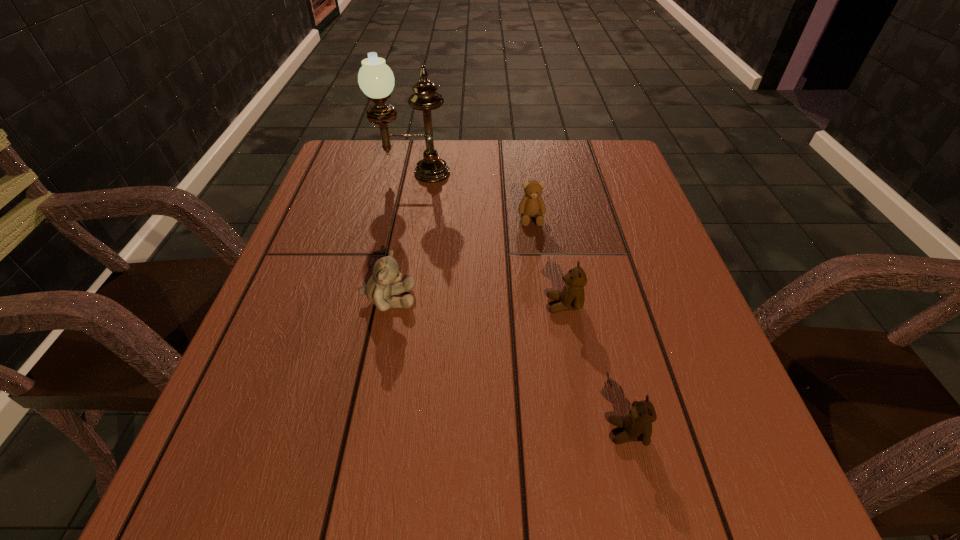
Image resolution: width=960 pixels, height=540 pixels. In the image, there is a desktop. In order to click on vacant space at the far left corner in this screenshot , I will do `click(355, 150)`.

Locate an element on the screen. The width and height of the screenshot is (960, 540). free space at the near left corner is located at coordinates (247, 489).

This screenshot has width=960, height=540. I want to click on blank space at the far right corner of the desktop, so click(592, 158).

This screenshot has height=540, width=960. In order to click on vacant area between the fourth nearest object and the rightmost teddy bear in this screenshot , I will do `click(580, 325)`.

At what (x,y) coordinates should I click in order to perform the action: click on free space between the rightmost object and the farthest teddy bear. Please return your answer as a coordinate pair (x, y). Looking at the image, I should click on (580, 325).

Where is `unoccupied area between the farthest object and the rightmost object`? The image size is (960, 540). unoccupied area between the farthest object and the rightmost object is located at coordinates (520, 302).

Find the location of a particular element. Image resolution: width=960 pixels, height=540 pixels. empty space between the second farthest object and the leftmost teddy bear is located at coordinates (460, 259).

Locate an element on the screen. free space that is in between the leftmost teddy bear and the tallest object is located at coordinates (400, 236).

You are a GUI agent. You are given a task and a screenshot of the screen. Output one action in this format:
    pyautogui.click(x=<x>, y=<y>)
    Task: Click on the empty location between the farthest teddy bear and the leftmost teddy bear
    The height and width of the screenshot is (540, 960).
    Given the screenshot: What is the action you would take?
    pyautogui.click(x=460, y=259)

The height and width of the screenshot is (540, 960). Find the location of `the fourth closest object to the leftmost teddy bear`. the fourth closest object to the leftmost teddy bear is located at coordinates (637, 425).